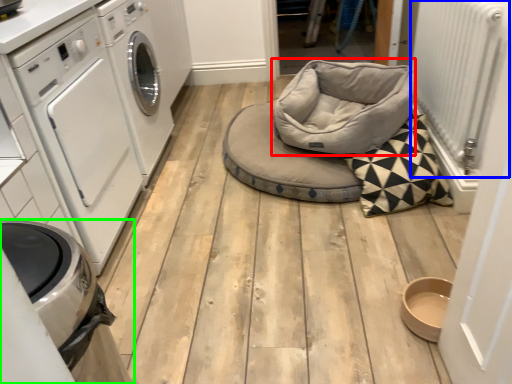
Question: Which object is the farthest from bean bag chair (highlighted by a red box)? Choose among these: radiator (highlighted by a blue box) or home appliance (highlighted by a green box).

Choices:
 (A) radiator
 (B) home appliance

Answer: (B)